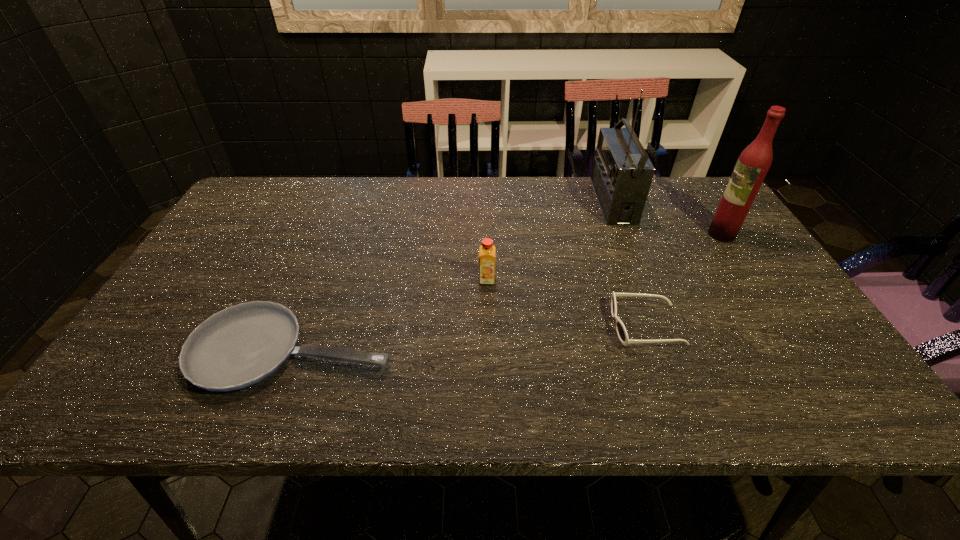
Where is `free spot between the sunglasses and the radio receiver`? The image size is (960, 540). free spot between the sunglasses and the radio receiver is located at coordinates (629, 264).

Identify the location of vacant space in between the third shortest object and the rightmost object. The image size is (960, 540). (x=604, y=257).

At what (x,y) coordinates should I click in order to perform the action: click on vacant point located between the shortest object and the liquor. Please return your answer as a coordinate pair (x, y). The width and height of the screenshot is (960, 540). Looking at the image, I should click on (507, 292).

The height and width of the screenshot is (540, 960). In order to click on vacant region between the liquor and the leftmost object in this screenshot , I will do `click(507, 292)`.

This screenshot has height=540, width=960. I want to click on vacant region between the farthest object and the sunglasses, so click(629, 264).

What are the coordinates of `blank region between the frying pan and the rightmost object` in the screenshot? It's located at (507, 292).

The image size is (960, 540). I want to click on vacant area between the orange juice and the radio receiver, so click(x=550, y=240).

Find the location of `vacant area between the second object from left to right and the radio receiver`. vacant area between the second object from left to right and the radio receiver is located at coordinates (550, 240).

The width and height of the screenshot is (960, 540). I want to click on vacant area between the second shortest object and the shortest object, so click(x=469, y=338).

Find the location of `the second closest object relative to the sunglasses`. the second closest object relative to the sunglasses is located at coordinates (755, 160).